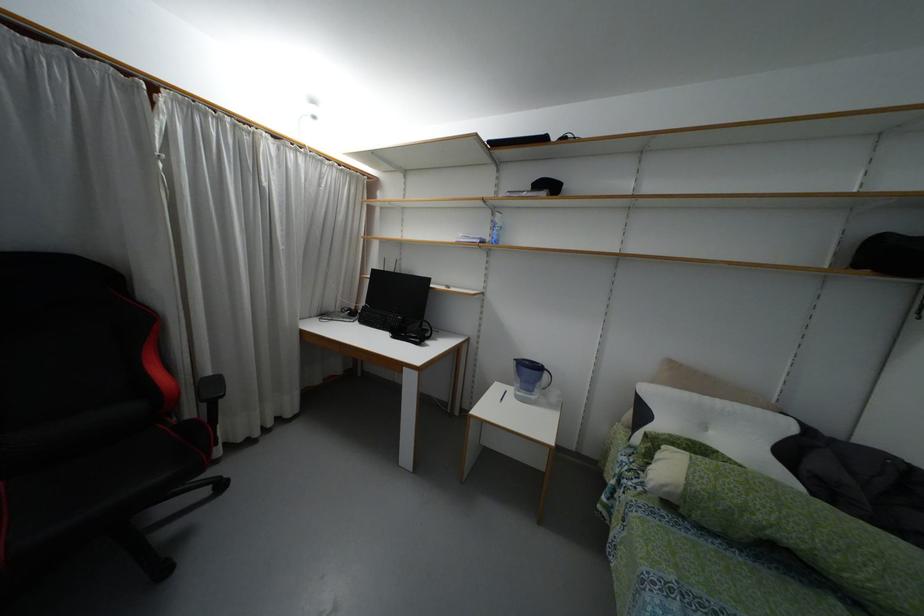
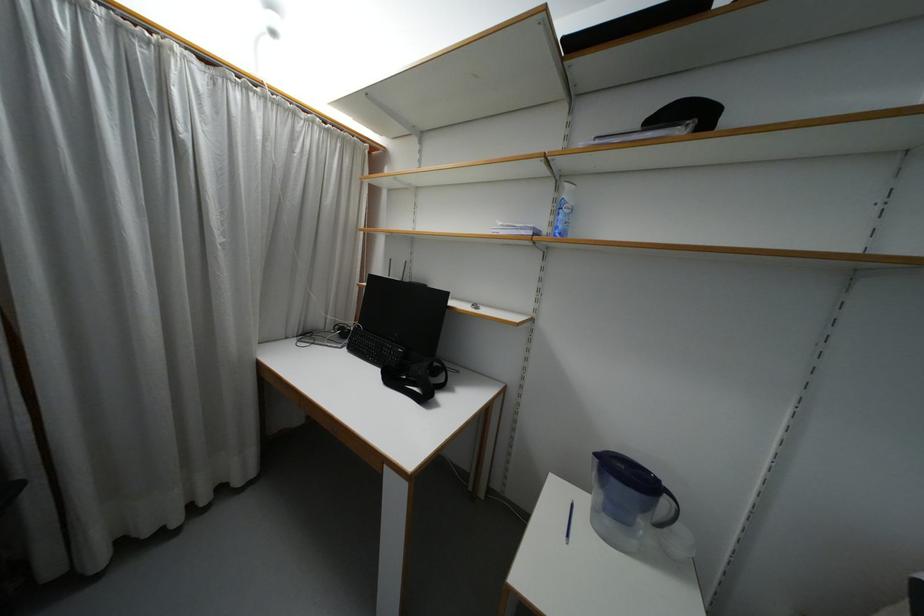
Question: The camera is either moving clockwise (left) or counter-clockwise (right) around the object. The first image is from the beginning of the video and the second image is from the end. Is the camera moving left or right when shooting the video?

Choices:
 (A) Left
 (B) Right

Answer: (B)